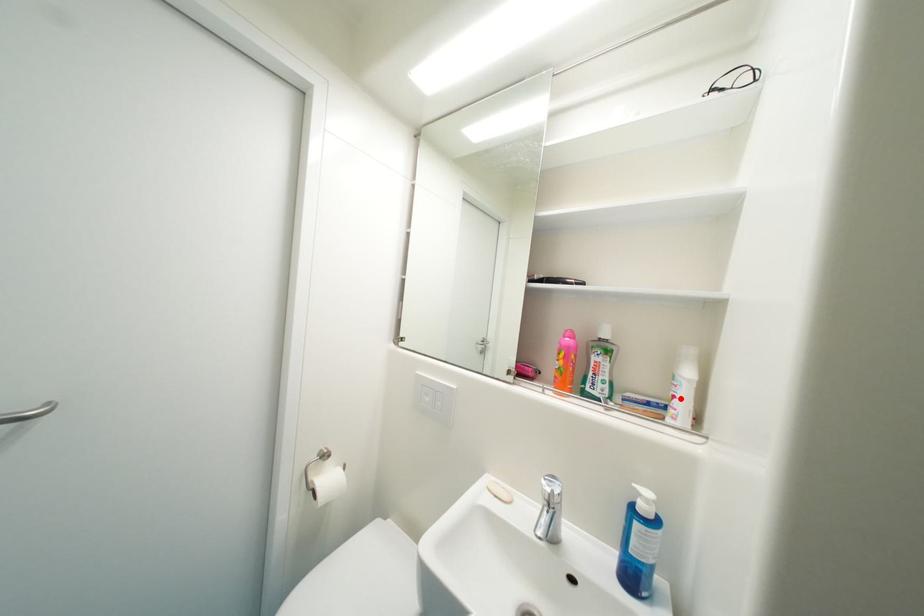
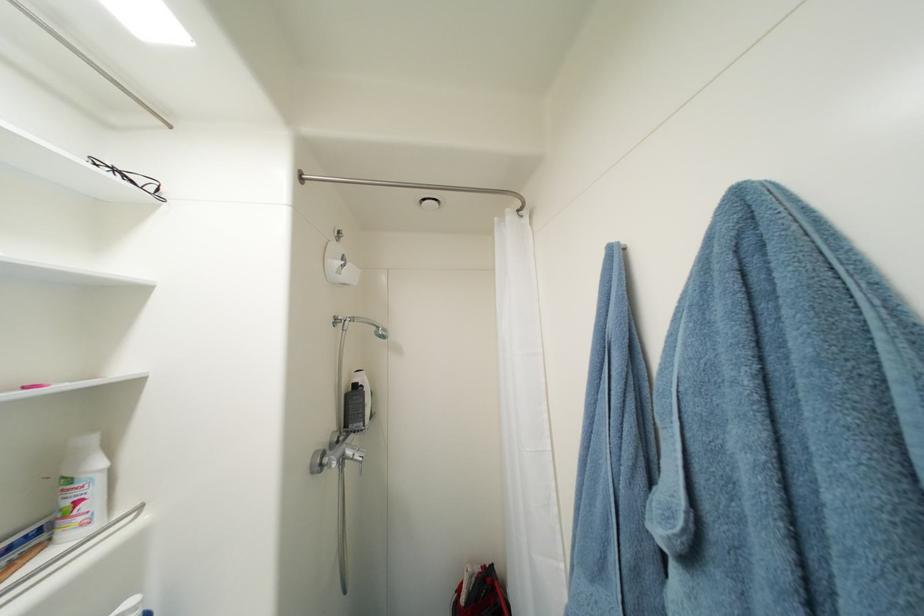
Question: I am providing you with two images of the same scene from different viewpoints. A red point is marked on the first image. At the location where the point appears in image 1, is it still visible in image 2?

Choices:
 (A) Yes
 (B) No

Answer: (A)